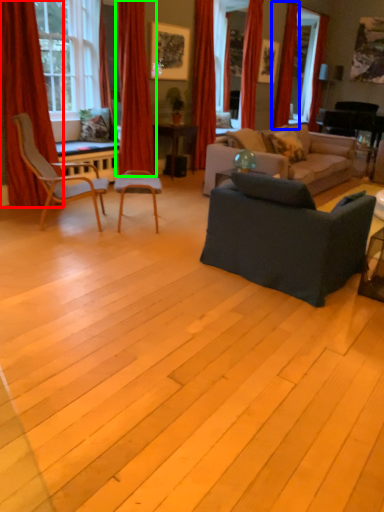
Question: Which is nearer to the curtain (highlighted by a red box)? curtain (highlighted by a blue box) or curtain (highlighted by a green box).

Choices:
 (A) curtain
 (B) curtain

Answer: (B)